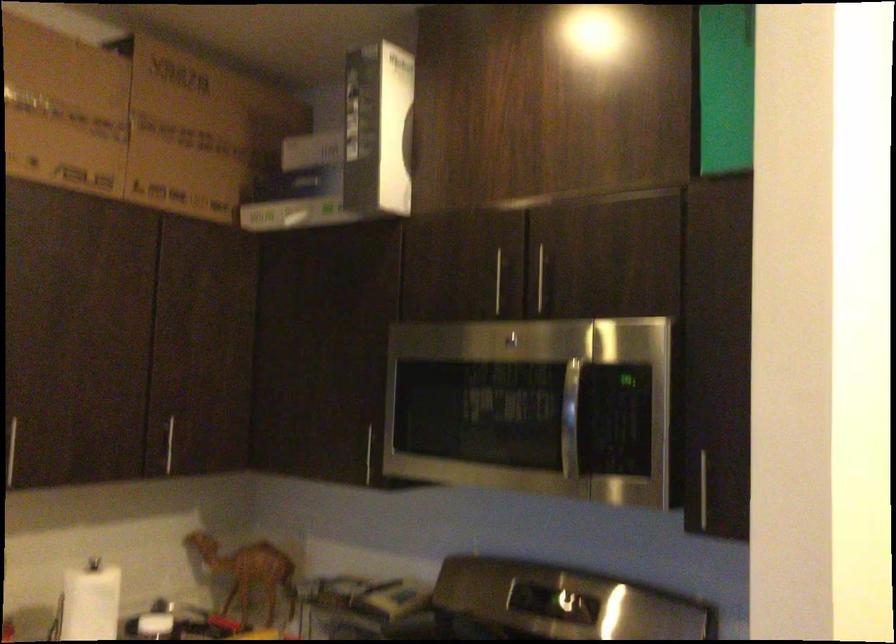
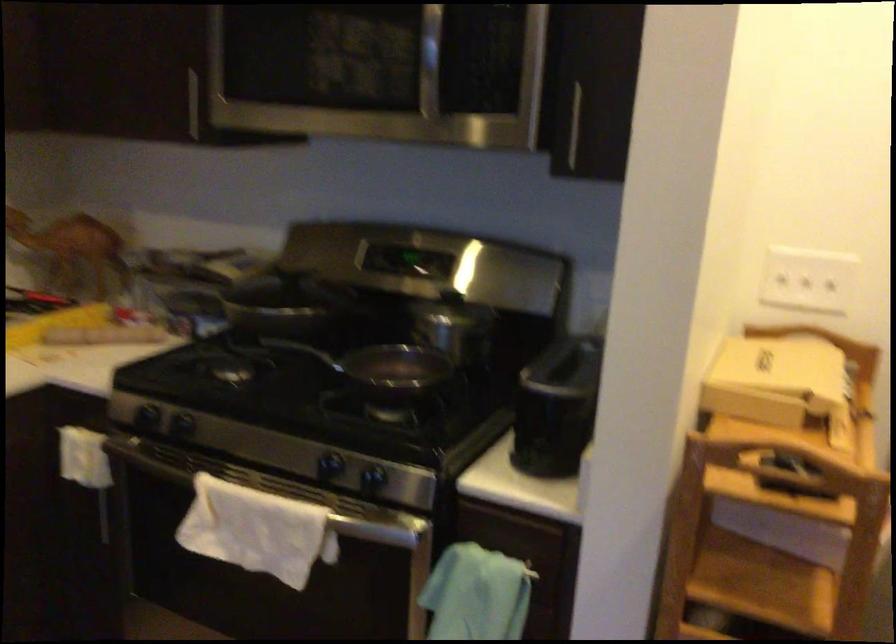
Question: Which direction would the cameraman need to move to produce the second image? Reply with the corresponding letter.

Choices:
 (A) Left
 (B) Right
 (C) Forward
 (D) Backward

Answer: (C)